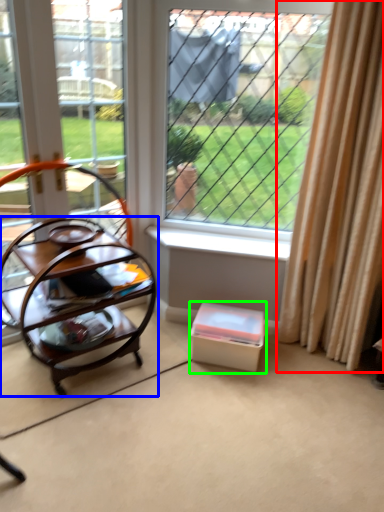
Question: Which object is positioned closest to curtain (highlighted by a red box)? Select from table (highlighted by a blue box) and storage box (highlighted by a green box).

Choices:
 (A) table
 (B) storage box

Answer: (B)